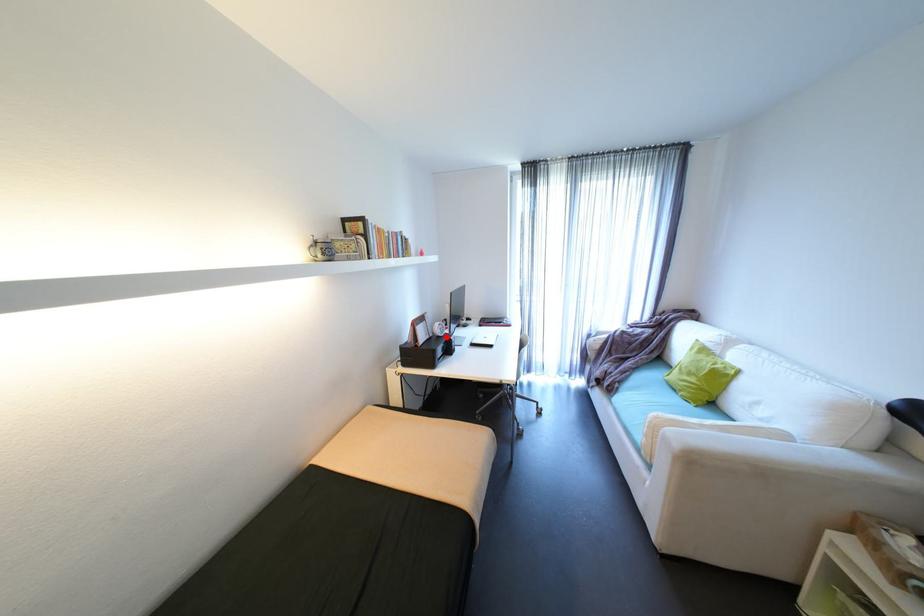
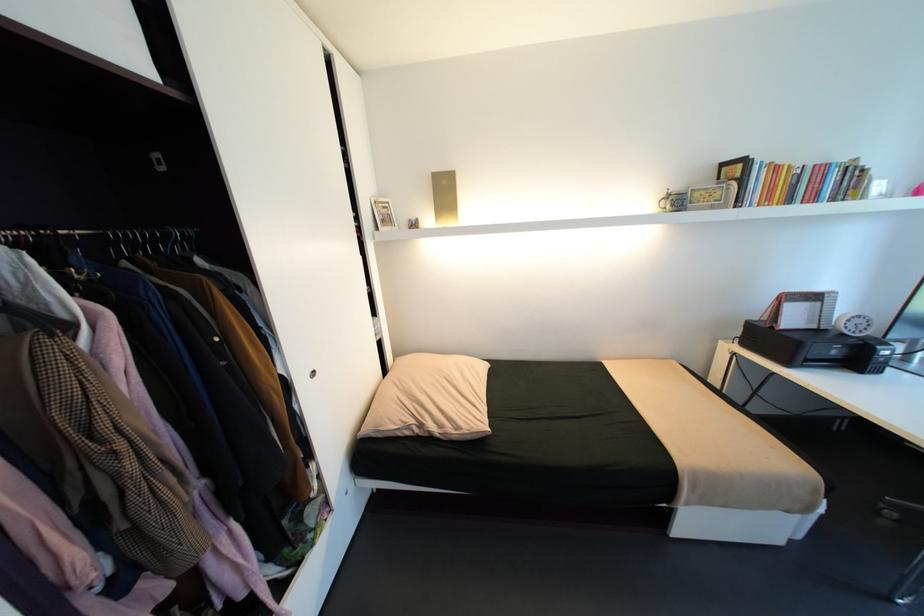
In the second image, find the point that corresponds to the highlighted location in the first image.

(850, 334)